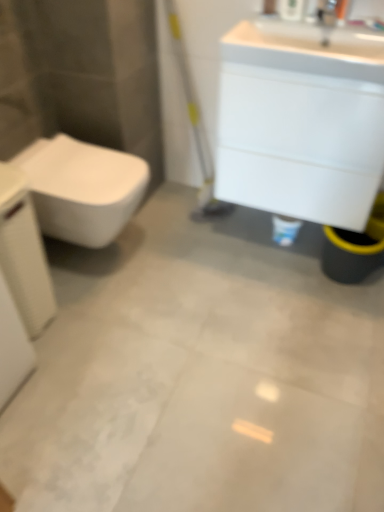
This screenshot has height=512, width=384. What are the coordinates of `white textured porcelain at left` in the screenshot? It's located at (24, 253).

Describe the element at coordinates (82, 188) in the screenshot. The width and height of the screenshot is (384, 512). I see `white glossy toilet at left` at that location.

The width and height of the screenshot is (384, 512). Find the location of `white glossy cabinet at upper right`. white glossy cabinet at upper right is located at coordinates [x=301, y=121].

What is the approximate width of white glossy cabinet at upper right?

The width of white glossy cabinet at upper right is 40.31 centimeters.

What is the approximate height of silver metallic faucet at upper right?

The height of silver metallic faucet at upper right is 4.77 inches.

Identify the location of white textured porcelain at left. coord(24,253).

Is white textured porcelain at left aimed at white glossy sink at upper right?

No, white textured porcelain at left is not turned towards white glossy sink at upper right.

Identify the location of sink that appears behind the white textured porcelain at left. (306, 49).

Is white textured porcelain at left far from white glossy sink at upper right?

That's not correct — white textured porcelain at left is a little close to white glossy sink at upper right.

From a real-world perspective, which is physically below, white glossy cabinet at upper right or silver metallic faucet at upper right?

In real-world perspective, white glossy cabinet at upper right is lower.

Based on the photo, between white glossy cabinet at upper right and silver metallic faucet at upper right, which one has smaller width?

silver metallic faucet at upper right.

How many degrees apart are the facing directions of white glossy cabinet at upper right and silver metallic faucet at upper right?

4.59 degrees separate the facing orientations of white glossy cabinet at upper right and silver metallic faucet at upper right.

Considering the relative sizes of white glossy cabinet at upper right and silver metallic faucet at upper right in the image provided, is white glossy cabinet at upper right shorter than silver metallic faucet at upper right?

In fact, white glossy cabinet at upper right may be taller than silver metallic faucet at upper right.

Is silver metallic faucet at upper right shorter than white glossy toilet at left?

Yes, silver metallic faucet at upper right is shorter than white glossy toilet at left.

Looking at this image, from the image's perspective, is silver metallic faucet at upper right above white glossy toilet at left?

Yes.

Which object is wider, silver metallic faucet at upper right or white glossy toilet at left?

With larger width is white glossy toilet at left.

Considering the sizes of objects silver metallic faucet at upper right and white glossy toilet at left in the image provided, who is bigger, silver metallic faucet at upper right or white glossy toilet at left?

white glossy toilet at left.

Does white glossy cabinet at upper right touch white glossy sink at upper right?

white glossy cabinet at upper right and white glossy sink at upper right are not in contact.

Who is smaller, white glossy cabinet at upper right or white glossy sink at upper right?

With smaller size is white glossy sink at upper right.

From the image's perspective, is white glossy cabinet at upper right under white glossy sink at upper right?

Yes.

Considering the sizes of white glossy cabinet at upper right and white glossy sink at upper right in the image, is white glossy cabinet at upper right taller or shorter than white glossy sink at upper right?

Considering their sizes, white glossy cabinet at upper right has more height than white glossy sink at upper right.

Can you tell me how much white textured porcelain at left and white glossy cabinet at upper right differ in facing direction?

The angle between the facing direction of white textured porcelain at left and the facing direction of white glossy cabinet at upper right is 90.7 degrees.

Which object is more forward, white textured porcelain at left or white glossy cabinet at upper right?

white textured porcelain at left.

From a real-world perspective, between white textured porcelain at left and white glossy cabinet at upper right, who is vertically lower?

white textured porcelain at left, from a real-world perspective.

Is white textured porcelain at left completely or partially outside of white glossy cabinet at upper right?

Yes.

Are white glossy toilet at left and white textured porcelain at left far apart?

That's not correct — white glossy toilet at left is a little close to white textured porcelain at left.

Would you say white glossy toilet at left is inside or outside white textured porcelain at left?

white glossy toilet at left is not enclosed by white textured porcelain at left.

Which object is positioned more to the left, white glossy toilet at left or white textured porcelain at left?

From the viewer's perspective, white textured porcelain at left appears more on the left side.

Is white glossy toilet at left oriented away from white textured porcelain at left?

That's not correct — white glossy toilet at left is not looking away from white textured porcelain at left.

Relative to white glossy cabinet at upper right, is silver metallic faucet at upper right in front or behind?

silver metallic faucet at upper right is positioned farther from the viewer than white glossy cabinet at upper right.

Which object is positioned more to the left, silver metallic faucet at upper right or white glossy cabinet at upper right?

white glossy cabinet at upper right.

In terms of width, does silver metallic faucet at upper right look wider or thinner when compared to white glossy cabinet at upper right?

In the image, silver metallic faucet at upper right appears to be more narrow than white glossy cabinet at upper right.

Locate an element on the screen. sink behind the white textured porcelain at left is located at coordinates (306, 49).

You are a GUI agent. You are given a task and a screenshot of the screen. Output one action in this format:
    pyautogui.click(x=<x>, y=<y>)
    Task: Click on the faucet above the white glossy cabinet at upper right (from a real-world perspective)
    
    Given the screenshot: What is the action you would take?
    pyautogui.click(x=327, y=12)

Estimate the real-world distances between objects in this image. Which object is further from white textured porcelain at left, white glossy cabinet at upper right or white glossy toilet at left?

The object further to white textured porcelain at left is white glossy cabinet at upper right.

Based on their spatial positions, is white glossy sink at upper right or white glossy cabinet at upper right further from silver metallic faucet at upper right?

white glossy cabinet at upper right lies further to silver metallic faucet at upper right than the other object.

Estimate the real-world distances between objects in this image. Which object is further from white glossy sink at upper right, silver metallic faucet at upper right or white glossy cabinet at upper right?

Among the two, silver metallic faucet at upper right is located further to white glossy sink at upper right.

Which object lies further to the anchor point white glossy sink at upper right, silver metallic faucet at upper right or white glossy toilet at left?

The object further to white glossy sink at upper right is white glossy toilet at left.

Looking at the image, which one is located further to white textured porcelain at left, white glossy sink at upper right or white glossy cabinet at upper right?

white glossy sink at upper right lies further to white textured porcelain at left than the other object.

When comparing their distances from white glossy sink at upper right, does white textured porcelain at left or silver metallic faucet at upper right seem closer?

silver metallic faucet at upper right is positioned closer to the anchor white glossy sink at upper right.

When comparing their distances from white glossy toilet at left, does white textured porcelain at left or white glossy sink at upper right seem further?

white glossy sink at upper right is further to white glossy toilet at left.

When comparing their distances from white glossy toilet at left, does white textured porcelain at left or white glossy cabinet at upper right seem closer?

Among the two, white textured porcelain at left is located nearer to white glossy toilet at left.

At what (x,y) coordinates should I click in order to perform the action: click on bathroom cabinet located between white glossy toilet at left and silver metallic faucet at upper right in the left-right direction. Please return your answer as a coordinate pair (x, y). The image size is (384, 512). Looking at the image, I should click on (301, 121).

I want to click on sink situated between white glossy toilet at left and white glossy cabinet at upper right from left to right, so click(306, 49).

Locate an element on the screen. sink situated between white glossy toilet at left and silver metallic faucet at upper right from left to right is located at coordinates (306, 49).

Where is `toilet between white textured porcelain at left and silver metallic faucet at upper right`? The height and width of the screenshot is (512, 384). toilet between white textured porcelain at left and silver metallic faucet at upper right is located at coordinates (82, 188).